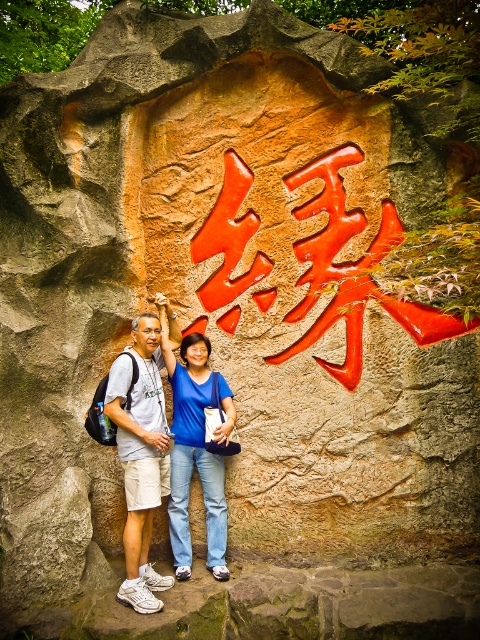
Who is more forward, (153, 476) or (188, 428)?

Positioned in front is point (153, 476).

Where is `white athletic shoes at left`? The image size is (480, 640). white athletic shoes at left is located at coordinates (142, 451).